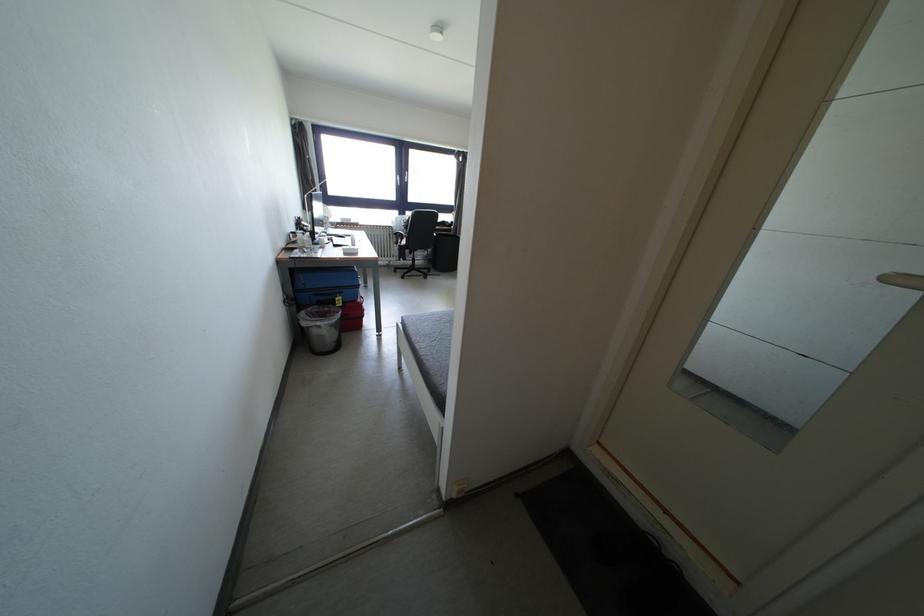
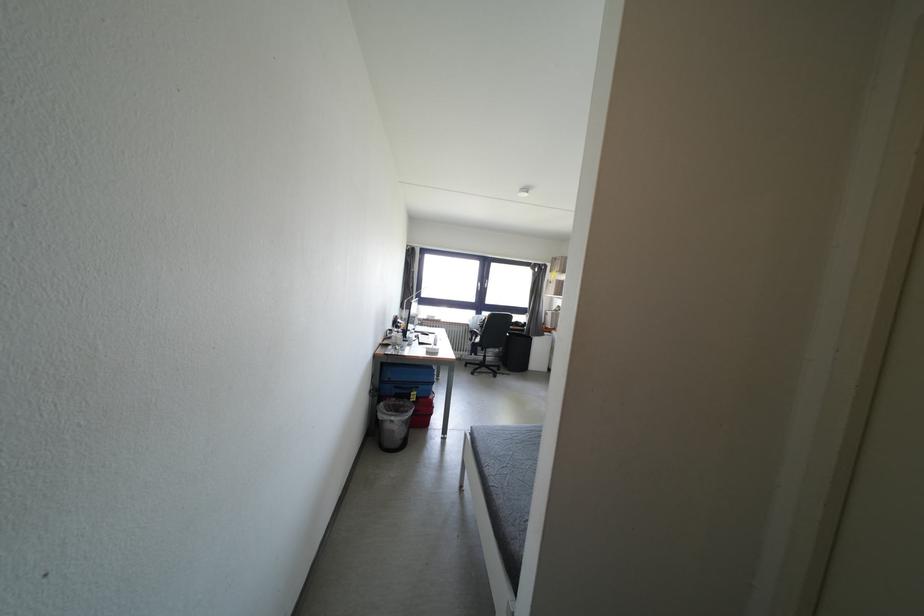
From the picture: First-person continuous shooting, in which direction is the camera rotating?

The rotation direction of the camera is left-up.